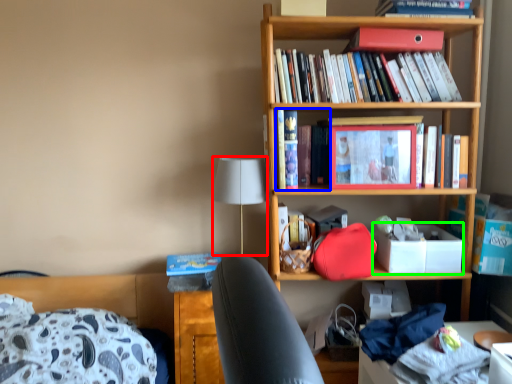
Question: Which is nearer to the lamp (highlighted by a red box)? book (highlighted by a blue box) or box (highlighted by a green box).

Choices:
 (A) book
 (B) box

Answer: (A)